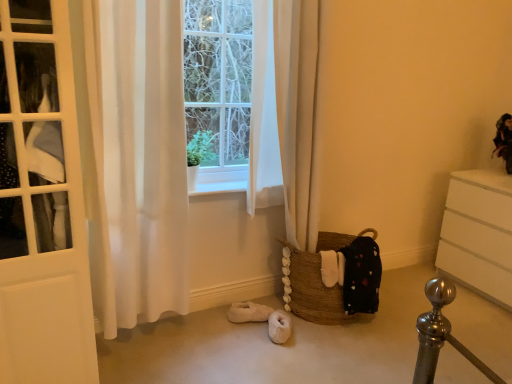
Question: Does white wood at center come in front of white sheer curtain at left?

Choices:
 (A) yes
 (B) no

Answer: (B)

Question: Can we say white wood at center lies outside white sheer curtain at left?

Choices:
 (A) no
 (B) yes

Answer: (B)

Question: Does white wood at center have a greater width compared to white sheer curtain at left?

Choices:
 (A) no
 (B) yes

Answer: (A)

Question: From the image's perspective, is white wood at center beneath white sheer curtain at left?

Choices:
 (A) yes
 (B) no

Answer: (A)

Question: Is white wood at center facing towards white sheer curtain at left?

Choices:
 (A) no
 (B) yes

Answer: (A)

Question: Is white sheer curtain at left situated inside white matte chest of drawers at right or outside?

Choices:
 (A) outside
 (B) inside

Answer: (A)

Question: Is white sheer curtain at left to the left or to the right of white matte chest of drawers at right in the image?

Choices:
 (A) left
 (B) right

Answer: (A)

Question: Considering their positions, is white sheer curtain at left located in front of or behind white matte chest of drawers at right?

Choices:
 (A) behind
 (B) front

Answer: (B)

Question: Is white sheer curtain at left bigger or smaller than white matte chest of drawers at right?

Choices:
 (A) small
 (B) big

Answer: (A)

Question: In the image, is brown woven basket at lower center positioned in front of or behind white sheer curtain at left?

Choices:
 (A) behind
 (B) front

Answer: (A)

Question: In terms of height, does brown woven basket at lower center look taller or shorter compared to white sheer curtain at left?

Choices:
 (A) tall
 (B) short

Answer: (B)

Question: From a real-world perspective, is brown woven basket at lower center physically located above or below white sheer curtain at left?

Choices:
 (A) below
 (B) above

Answer: (A)

Question: Is point (347, 243) positioned closer to the camera than point (129, 306)?

Choices:
 (A) farther
 (B) closer

Answer: (A)

Question: Is point (305, 317) positioned closer to the camera than point (503, 139)?

Choices:
 (A) farther
 (B) closer

Answer: (B)

Question: Is brown woven basket at lower center to the left or to the right of velvet-like doll at upper right in the image?

Choices:
 (A) right
 (B) left

Answer: (B)